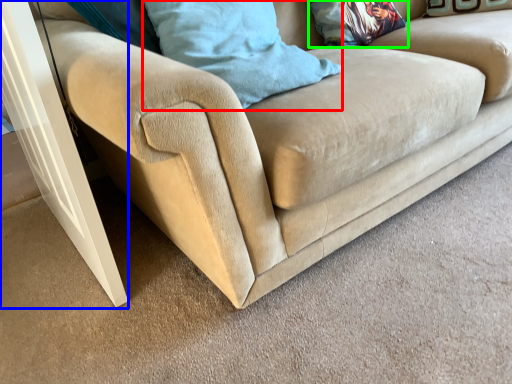
Question: Which object is the closest to the pillow (highlighted by a red box)? Choose among these: screen door (highlighted by a blue box) or pillow (highlighted by a green box).

Choices:
 (A) screen door
 (B) pillow

Answer: (A)